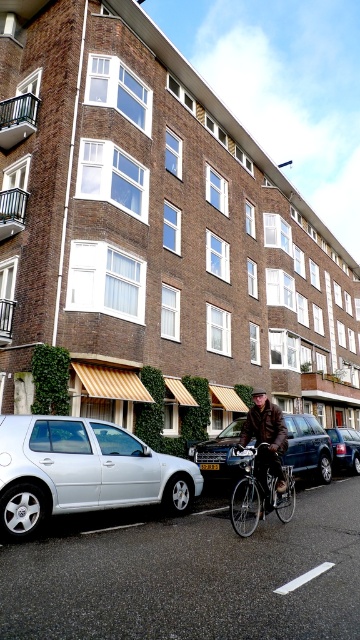
Is metallic silver sedan at center thinner than yellow plastic license plate at center?

Incorrect, metallic silver sedan at center's width is not less than yellow plastic license plate at center's.

Between point (348, 444) and point (210, 465), which one is positioned behind?

The point (348, 444) is more distant.

The image size is (360, 640). In order to click on metallic silver sedan at center in this screenshot , I will do `click(344, 449)`.

Does metallic silver car at center have a larger size compared to brown leather jacket at center?

No.

Between metallic silver car at center and brown leather jacket at center, which one is positioned lower?

metallic silver car at center

Is point (321, 435) farther from viewer compared to point (276, 449)?

Yes, point (321, 435) is farther from viewer.

I want to click on metallic silver car at center, so (308, 448).

Can you confirm if silver metallic bicycle at center is positioned to the right of brown leather jacket at center?

Correct, you'll find silver metallic bicycle at center to the right of brown leather jacket at center.

Is point (254, 470) positioned after point (257, 474)?

No, it is in front of (257, 474).

At what (x,y) coordinates should I click in order to perform the action: click on silver metallic bicycle at center. Please return your answer as a coordinate pair (x, y). The height and width of the screenshot is (640, 360). Looking at the image, I should click on (258, 492).